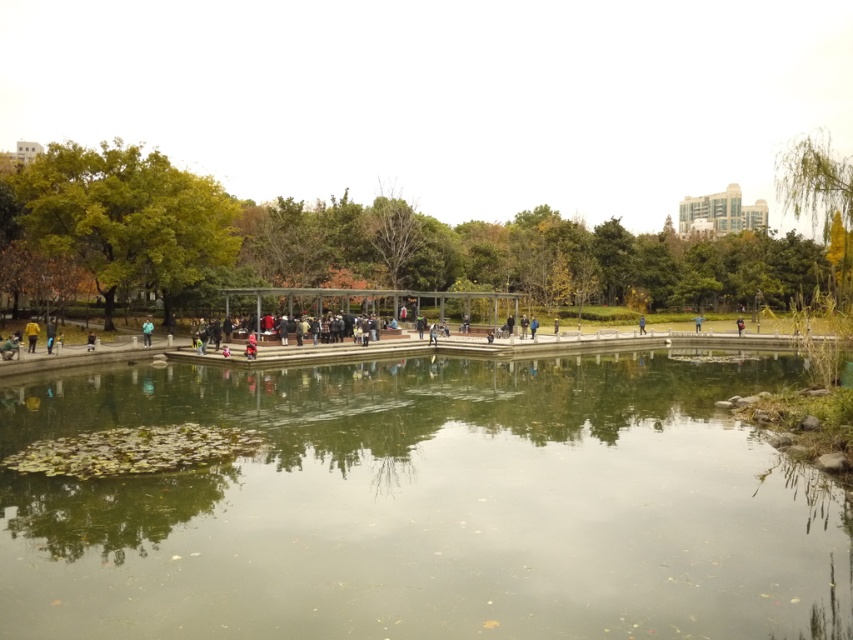
You are standing on the paved walkway in the park and see the green reflective water at center and the green fabric jacket at center. Which object is closer to you?

The green reflective water at center is positioned under the green fabric jacket at center, so the green fabric jacket at center is closer to you.